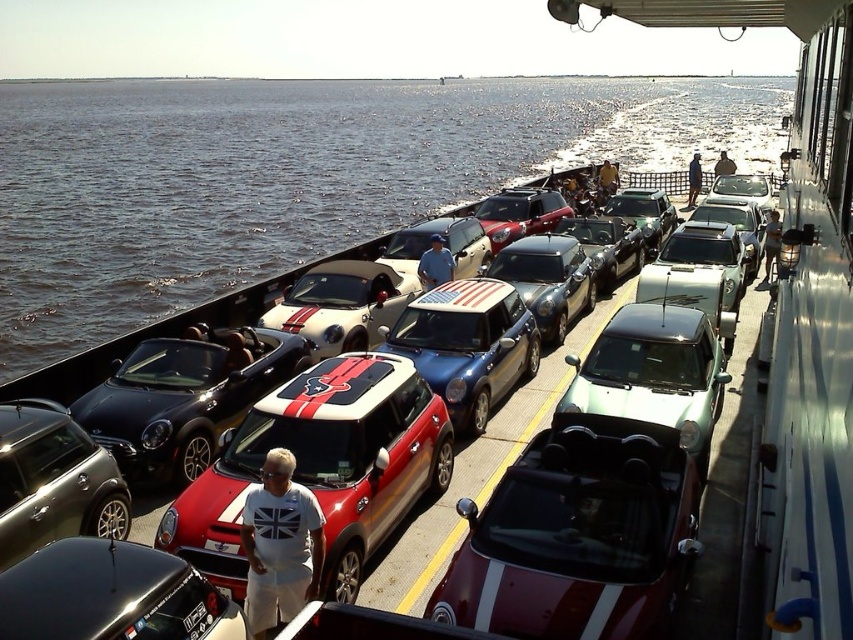
You are on a ferry deck and want to take a photo of the blue metallic car at center without any obstructions. Since the blue water at center is in the way, can you move to the left side of the deck to get a clear view?

The blue metallic car at center is behind the blue water at center, so moving to the left side of the deck might not remove the obstruction of the blue water at center. You might need to find another angle where the blue metallic car at center is visible without the blue water at center blocking the view.